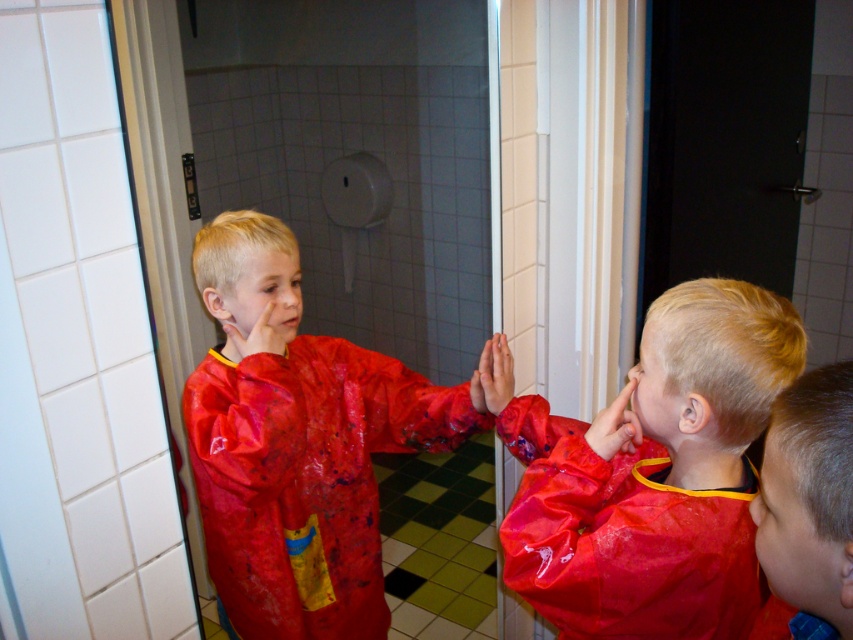
Question: Which of these objects is positioned closest to the shiny red raincoat at center?

Choices:
 (A) shiny red raincoat at right
 (B) shiny red raincoat at lower right

Answer: (A)

Question: Does shiny red raincoat at center lie in front of shiny red raincoat at lower right?

Choices:
 (A) yes
 (B) no

Answer: (B)

Question: Which point appears closest to the camera in this image?

Choices:
 (A) (569, 632)
 (B) (844, 468)
 (C) (283, 228)

Answer: (B)

Question: Which point is closer to the camera?

Choices:
 (A) shiny red raincoat at lower right
 (B) shiny red raincoat at right

Answer: (A)

Question: Is shiny red raincoat at right to the right of shiny red raincoat at center from the viewer's perspective?

Choices:
 (A) no
 (B) yes

Answer: (B)

Question: Is shiny red raincoat at center thinner than shiny red raincoat at lower right?

Choices:
 (A) yes
 (B) no

Answer: (B)